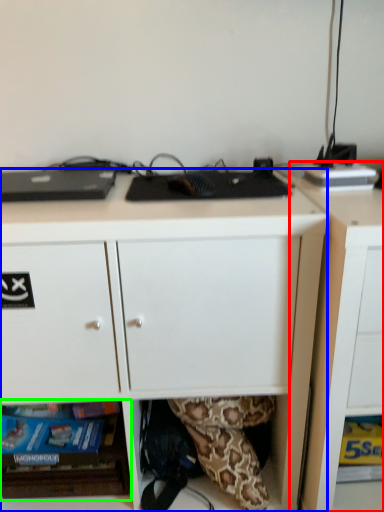
Question: Which object is positioned farthest from cabinetry (highlighted by a red box)? Select from desk (highlighted by a blue box) and shelf (highlighted by a green box).

Choices:
 (A) desk
 (B) shelf

Answer: (B)